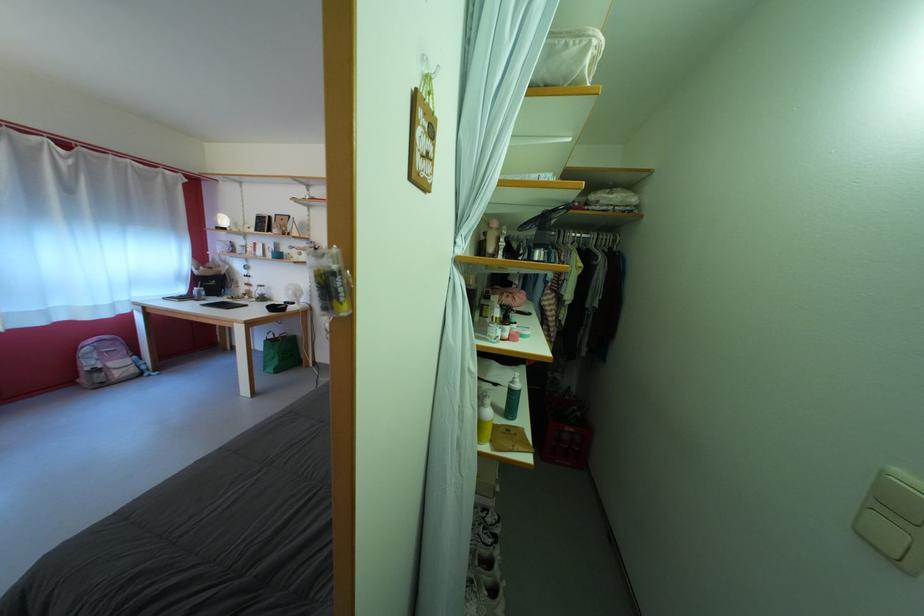
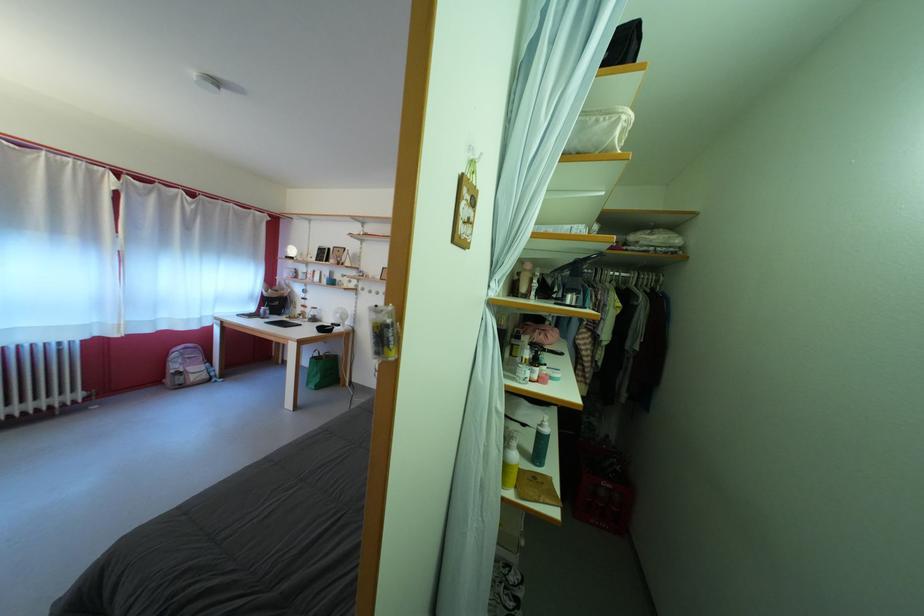
Question: Which direction would the cameraman need to move to produce the second image? Reply with the corresponding letter.

Choices:
 (A) Left
 (B) Right
 (C) Forward
 (D) Backward

Answer: (D)